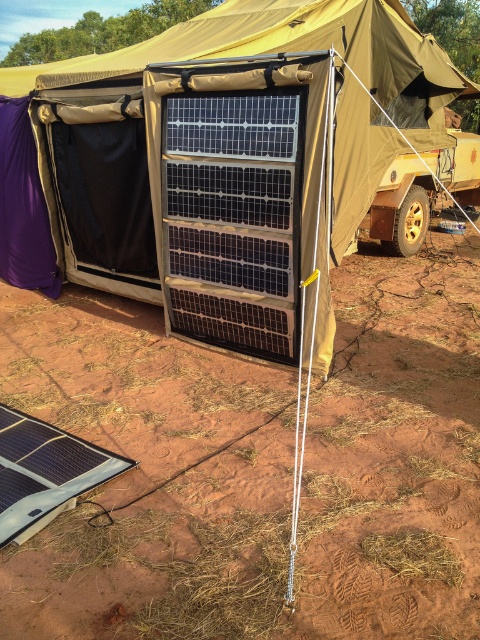
Does black solar panel at center have a lesser width compared to black textured solar panel at center?

Yes.

Is black solar panel at center to the right of black textured solar panel at center from the viewer's perspective?

Correct, you'll find black solar panel at center to the right of black textured solar panel at center.

Where is `black solar panel at center`? Image resolution: width=480 pixels, height=640 pixels. black solar panel at center is located at coordinates (231, 160).

Which is more to the right, black solar panel at center or black flexible solar panel at lower left?

black solar panel at center

Does black solar panel at center appear over black flexible solar panel at lower left?

Indeed, black solar panel at center is positioned over black flexible solar panel at lower left.

Is point (132, 253) less distant than point (98, 460)?

No, it is behind (98, 460).

Where is `black solar panel at center`? The image size is (480, 640). black solar panel at center is located at coordinates (231, 160).

Who is more distant from viewer, (x=37, y=397) or (x=55, y=432)?

Point (x=37, y=397)

Does point (116, 342) come in front of point (88, 470)?

That is False.

At what (x,y) coordinates should I click in order to perform the action: click on dirt at lower left. Please return your answer as a coordinate pair (x, y). Looking at the image, I should click on (260, 467).